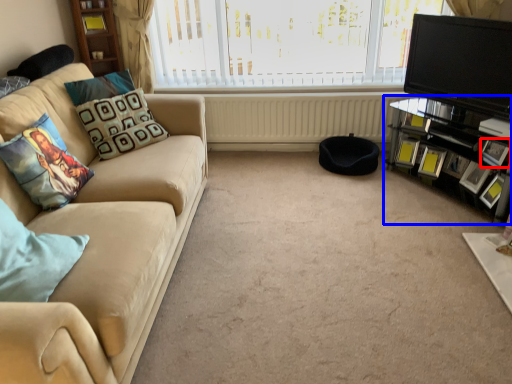
Question: Among these objects, which one is nearest to the camera, picture frame (highlighted by a red box) or entertainment center (highlighted by a blue box)?

Choices:
 (A) picture frame
 (B) entertainment center

Answer: (B)